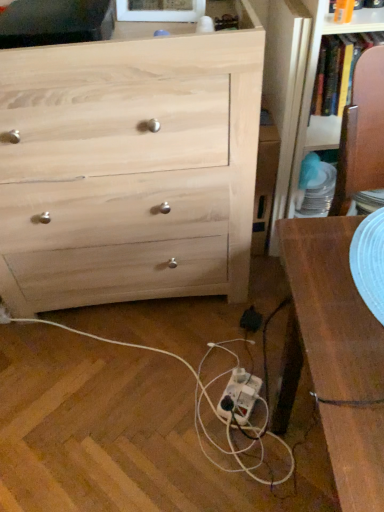
The width and height of the screenshot is (384, 512). I want to click on free space in front of white plastic extension cord at lower center, so click(242, 456).